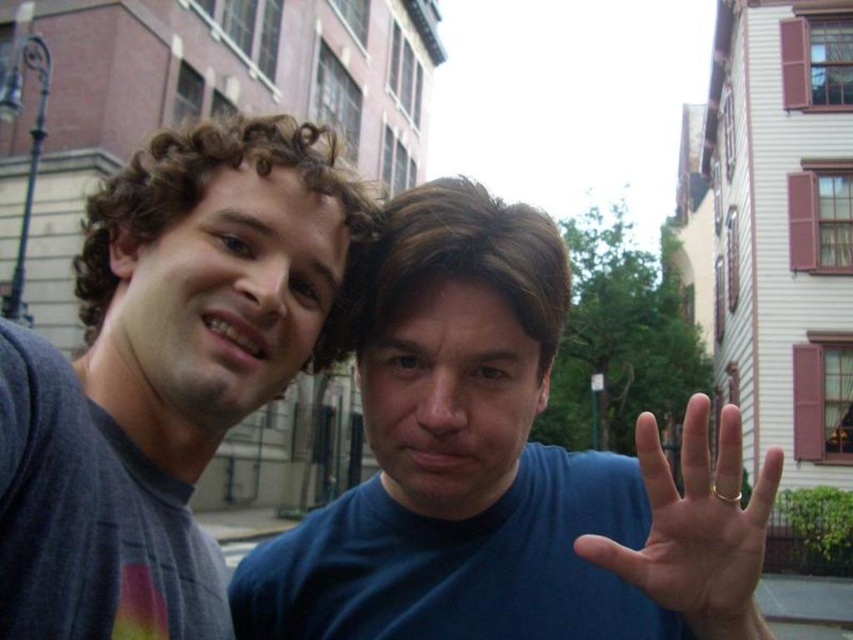
Between gray matte t-shirt at left and gold metallic ring at center, which one is positioned lower?

gold metallic ring at center is below.

Who is shorter, gray matte t-shirt at left or gold metallic ring at center?

With less height is gold metallic ring at center.

Is point (361, 196) in front of point (730, 468)?

No, it is behind (730, 468).

The height and width of the screenshot is (640, 853). I want to click on gray matte t-shirt at left, so click(164, 374).

Does blue matte shirt at center have a lesser width compared to gold metallic ring at center?

Yes, blue matte shirt at center is thinner than gold metallic ring at center.

Which is behind, point (688, 589) or point (753, 611)?

The point (753, 611) is behind.

Does point (566, 316) come farther from viewer compared to point (757, 531)?

That is True.

In order to click on blue matte shirt at center in this screenshot , I will do `click(502, 468)`.

Does blue matte shirt at center have a larger size compared to gray matte t-shirt at left?

Correct, blue matte shirt at center is larger in size than gray matte t-shirt at left.

Between blue matte shirt at center and gray matte t-shirt at left, which one has more height?

gray matte t-shirt at left is taller.

You are a GUI agent. You are given a task and a screenshot of the screen. Output one action in this format:
    pyautogui.click(x=<x>, y=<y>)
    Task: Click on the blue matte shirt at center
    The height and width of the screenshot is (640, 853).
    Given the screenshot: What is the action you would take?
    pyautogui.click(x=502, y=468)